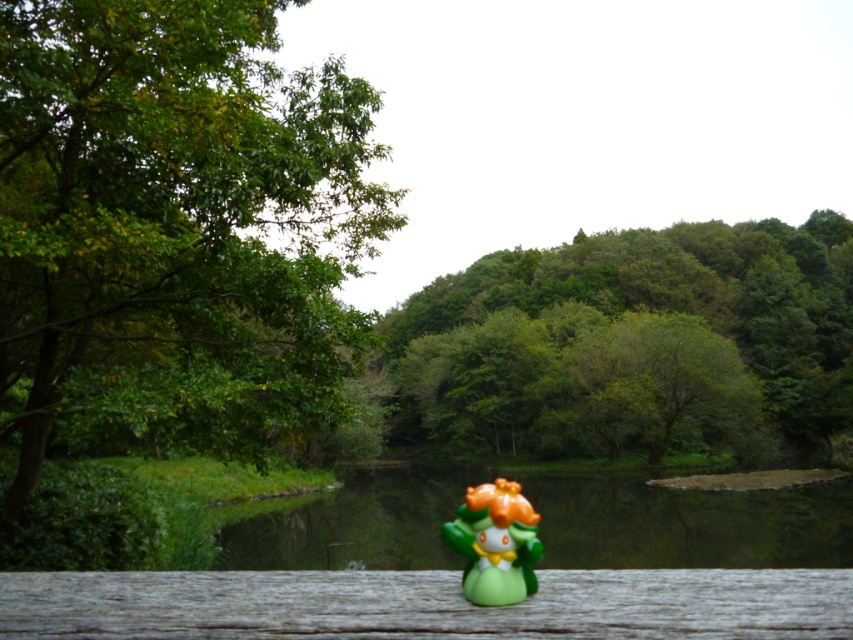
You are an artist planning to paint this scene. You want to ensure the green leafy trees at center and the green glossy river at center are proportionally accurate. Based on their sizes in the image, which object should you depict as larger in your painting?

The green leafy trees at center should be depicted as larger than the green glossy river at center in the painting since the green leafy trees at center has a larger size compared to the green glossy river at center according to the description.

You are standing on the wooden surface where the green matte figurine at center is placed. Looking towards the green leafy tree at left, do you think the tree is taller than the figurine?

The green leafy tree at left is shorter than the green matte figurine at center, so no, the tree is not taller than the figurine.